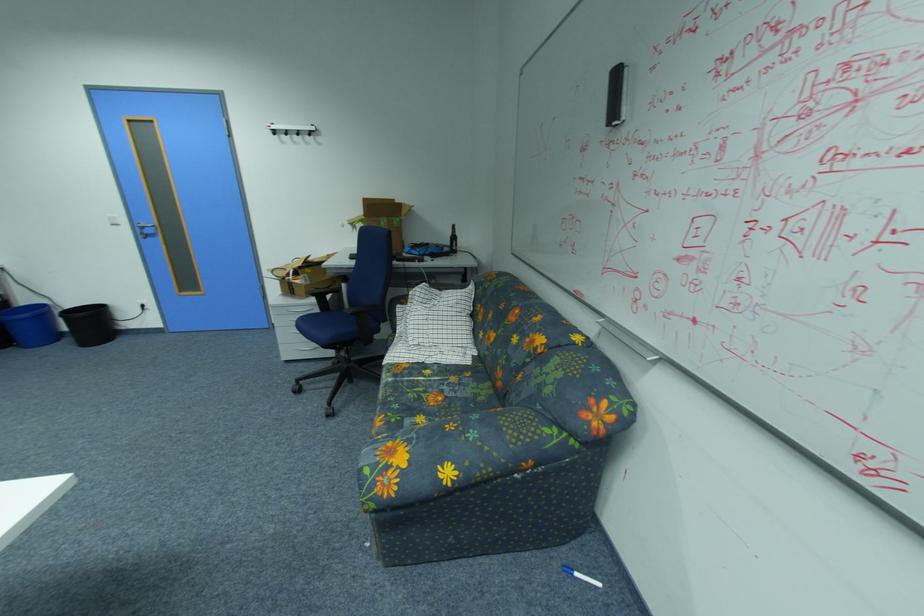
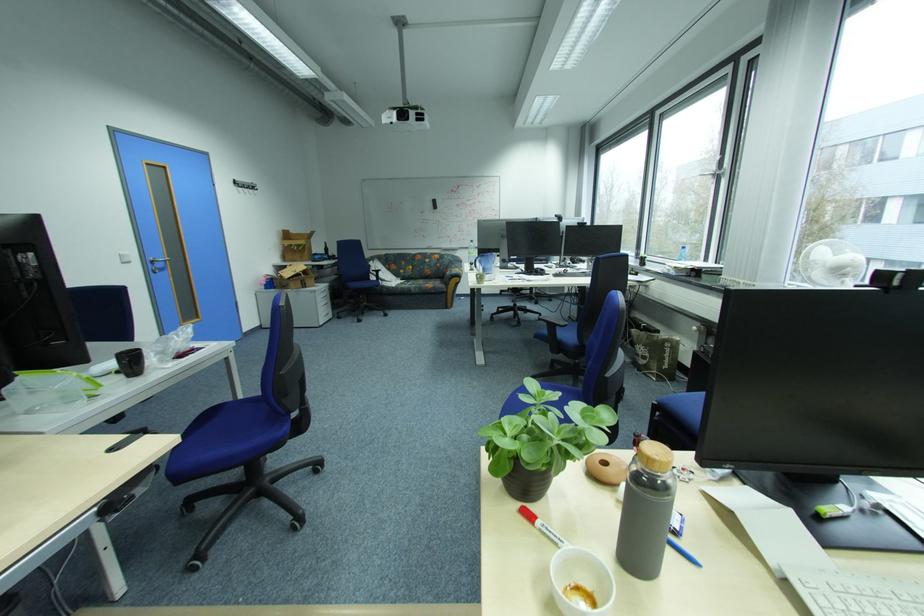
Find the pixel in the second image that matches point (118, 217) in the first image.

(130, 254)